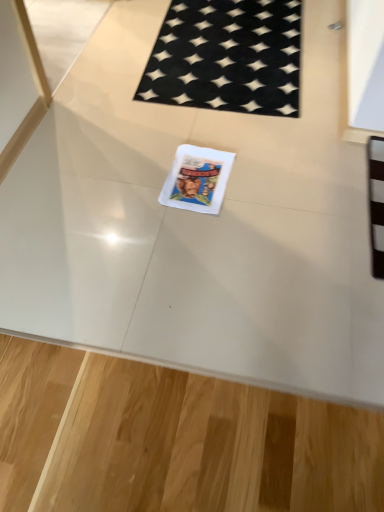
Question: In terms of width, does black woven mat at upper center look wider or thinner when compared to white paper comic book at center?

Choices:
 (A) thin
 (B) wide

Answer: (B)

Question: Do you think black woven mat at upper center is within white paper comic book at center, or outside of it?

Choices:
 (A) outside
 (B) inside

Answer: (A)

Question: Considering their positions, is black woven mat at upper center located in front of or behind white paper comic book at center?

Choices:
 (A) front
 (B) behind

Answer: (B)

Question: From the image's perspective, relative to black woven mat at upper center, is white paper comic book at center above or below?

Choices:
 (A) above
 (B) below

Answer: (B)

Question: Is white paper comic book at center wider or thinner than black woven mat at upper center?

Choices:
 (A) thin
 (B) wide

Answer: (A)

Question: Considering the positions of white paper comic book at center and black woven mat at upper center in the image, is white paper comic book at center taller or shorter than black woven mat at upper center?

Choices:
 (A) tall
 (B) short

Answer: (A)

Question: Based on their positions, is white paper comic book at center located to the left or right of black woven mat at upper center?

Choices:
 (A) left
 (B) right

Answer: (A)